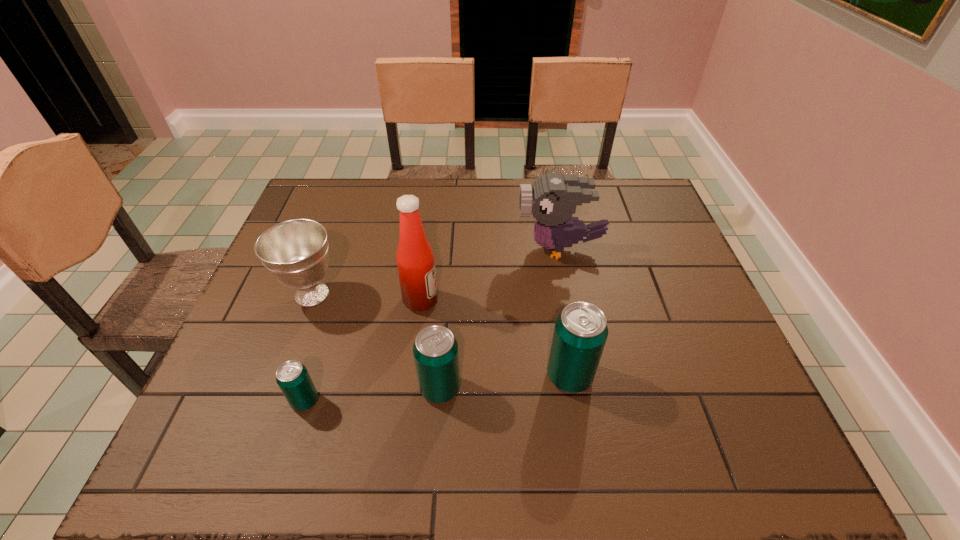
Identify the location of free space located 0.110m at the beak of the bird. The height and width of the screenshot is (540, 960). (477, 248).

I want to click on free space located at the beak of the bird, so click(x=452, y=248).

Locate an element on the screen. free location located 0.260m at the beak of the bird is located at coordinates (424, 248).

Where is `vacant region located 0.330m on the front-facing side of the condiment`? This screenshot has width=960, height=540. vacant region located 0.330m on the front-facing side of the condiment is located at coordinates (570, 300).

At what (x,y) coordinates should I click in order to perform the action: click on free location located 0.150m on the right of the chalice. Please return your answer as a coordinate pair (x, y). The height and width of the screenshot is (540, 960). Looking at the image, I should click on (402, 294).

You are a GUI agent. You are given a task and a screenshot of the screen. Output one action in this format:
    pyautogui.click(x=<x>, y=<y>)
    Task: Click on the object at the left edge
    
    Given the screenshot: What is the action you would take?
    pyautogui.click(x=295, y=252)

I want to click on free space at the far edge, so click(516, 211).

In the image, there is a desktop. At what (x,y) coordinates should I click in order to perform the action: click on free space at the left edge. Please return your answer as a coordinate pair (x, y). Looking at the image, I should click on (254, 331).

In the image, there is a desktop. Identify the location of free space at the right edge. The height and width of the screenshot is (540, 960). (654, 232).

In order to click on vacant space at the near left corner of the desktop in this screenshot , I will do `click(221, 390)`.